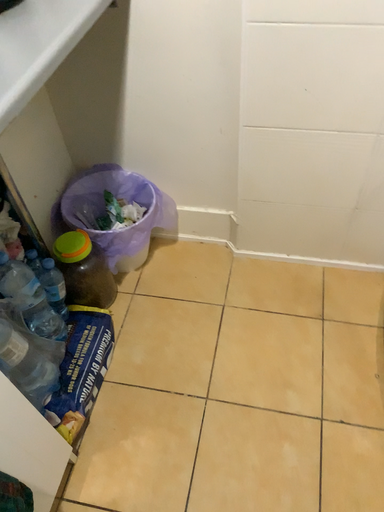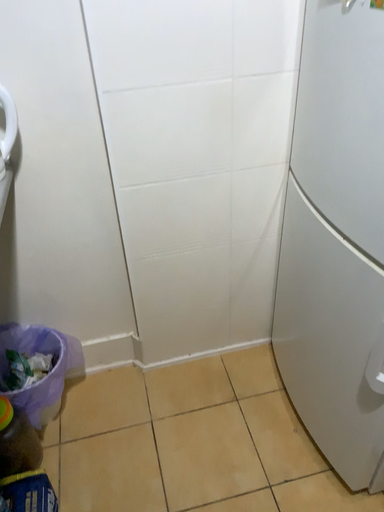
Question: How did the camera likely rotate when shooting the video?

Choices:
 (A) rotated upward
 (B) rotated downward

Answer: (A)